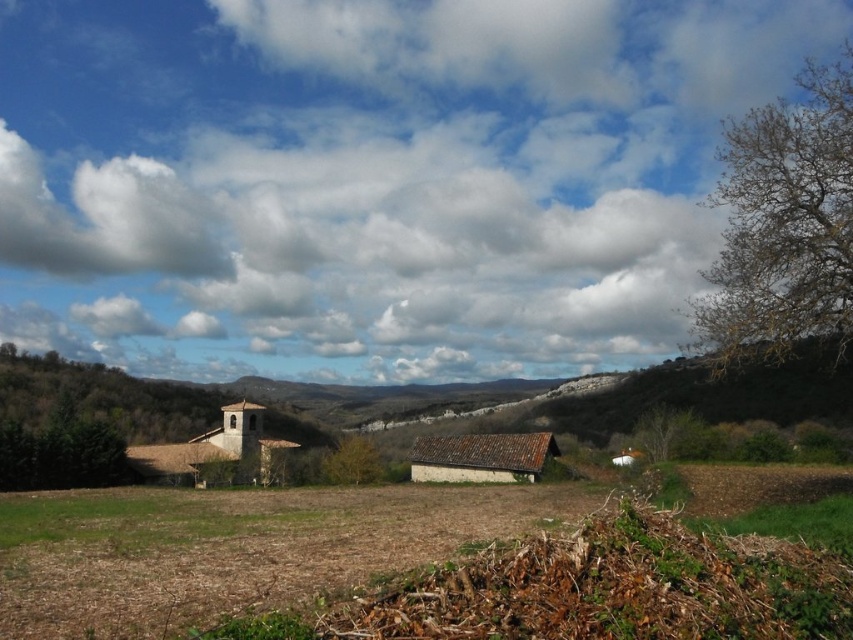
Question: Is bare wood tree at right further to camera compared to green leafy tree at center?

Choices:
 (A) no
 (B) yes

Answer: (A)

Question: Which object is positioned closest to the brown soil at lower center?

Choices:
 (A) green matte tree at left
 (B) green leafy tree at center
 (C) cloudy sky at upper center

Answer: (A)

Question: Does cloudy sky at upper center have a greater width compared to brown clay hut at center?

Choices:
 (A) yes
 (B) no

Answer: (A)

Question: Which point is closer to the camera?

Choices:
 (A) (677, 432)
 (B) (355, 435)
 (C) (552, 436)
 (D) (151, 580)

Answer: (D)

Question: Is the position of bare wood tree at right less distant than that of green matte tree at left?

Choices:
 (A) no
 (B) yes

Answer: (B)

Question: Among these objects, which one is nearest to the camera?

Choices:
 (A) brown soil at lower center
 (B) brown rough tree at right
 (C) bare wood tree at right
 (D) green matte tree at left

Answer: (A)